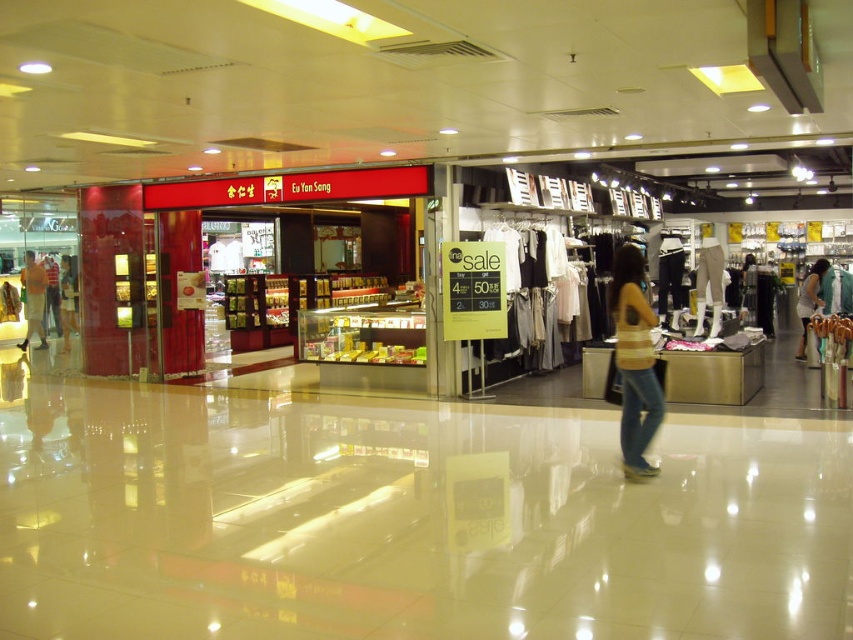
Question: Estimate the real-world distances between objects in this image. Which object is farther from the light beige fabric dress at center?

Choices:
 (A) striped jersey at center
 (B) orange fabric shirt at left

Answer: (B)

Question: Is orange fabric shirt at left to the right of light beige fabric dress at center from the viewer's perspective?

Choices:
 (A) yes
 (B) no

Answer: (B)

Question: Can you confirm if light beige fabric dress at center is thinner than matte black shirt at left?

Choices:
 (A) no
 (B) yes

Answer: (B)

Question: Among these points, which one is nearest to the camera?

Choices:
 (A) (622, 406)
 (B) (62, 298)
 (C) (28, 316)
 (D) (809, 273)

Answer: (A)

Question: From the image, what is the correct spatial relationship of striped jersey at center in relation to light beige fabric dress at center?

Choices:
 (A) left
 (B) right

Answer: (A)

Question: Estimate the real-world distances between objects in this image. Which object is closer to the orange fabric shirt at left?

Choices:
 (A) light beige fabric dress at center
 (B) matte black shirt at left

Answer: (B)